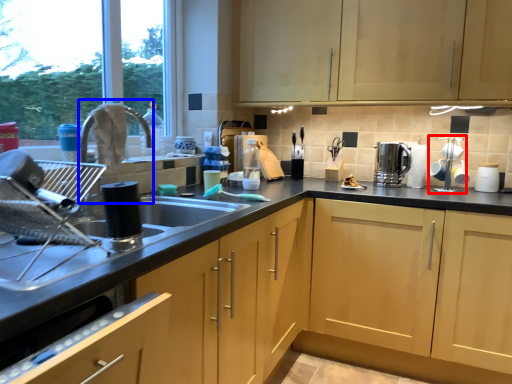
Question: Among these objects, which one is nearest to the camera, appliance (highlighted by a red box) or faucet (highlighted by a blue box)?

Choices:
 (A) appliance
 (B) faucet

Answer: (B)